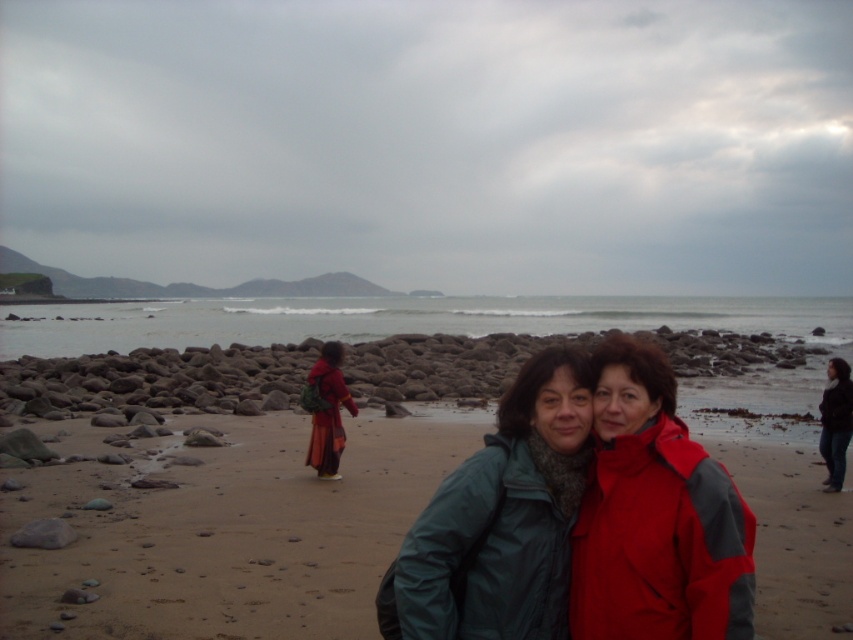
Question: Is green matte jacket at center in front of rockysmoothrocks at center?

Choices:
 (A) no
 (B) yes

Answer: (B)

Question: Based on their relative distances, which object is nearer to the matte orange dress at center?

Choices:
 (A) dark blue jeans at lower right
 (B) green matte jacket at center
 (C) clear water at center

Answer: (A)

Question: From the image, what is the correct spatial relationship of clear water at center in relation to matte orange dress at center?

Choices:
 (A) right
 (B) left

Answer: (A)

Question: Which object appears closest to the camera in this image?

Choices:
 (A) clear water at center
 (B) green matte jacket at center

Answer: (B)

Question: In this image, where is rockysmoothrocks at center located relative to dark blue jeans at lower right?

Choices:
 (A) above
 (B) below

Answer: (A)

Question: Which point is farther from the camera taking this photo?

Choices:
 (A) (845, 387)
 (B) (223, 368)
 (C) (312, 449)
 (D) (281, 534)

Answer: (B)